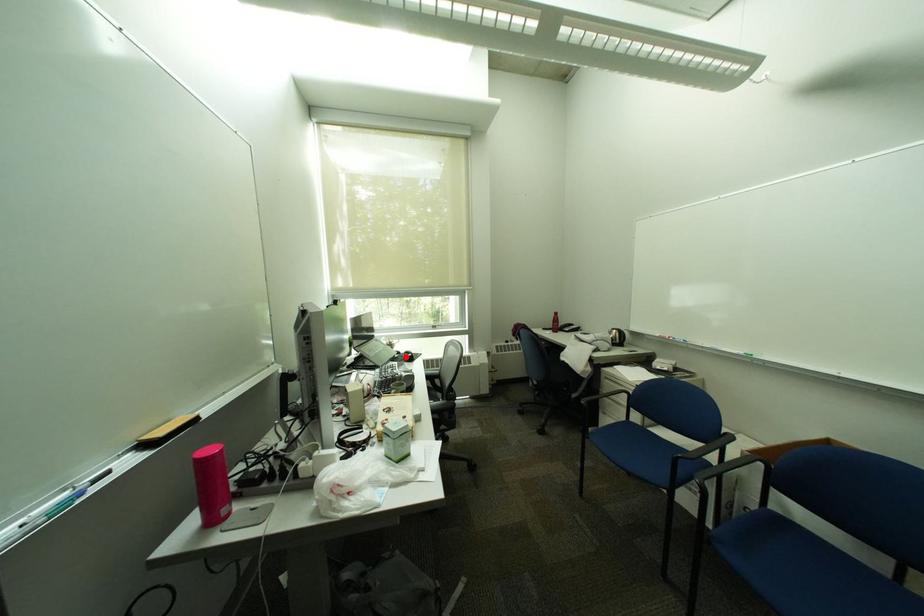
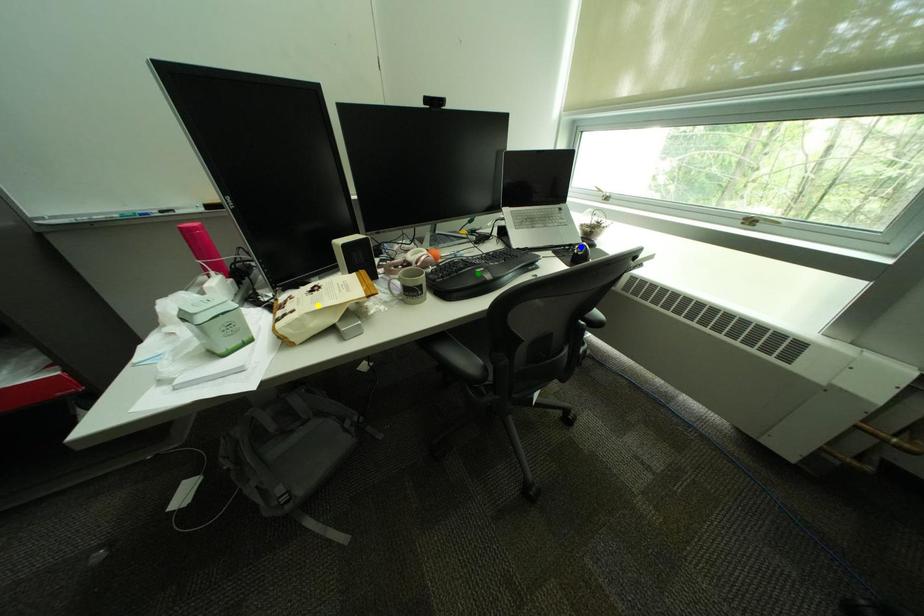
Question: I am providing you with two images of the same scene from different viewpoints. A red point is marked on the first image. You are given multiple points on the second image. Which point in image 2 is actually the same real-world point as the red point in image 1?

Choices:
 (A) green point
 (B) yellow point
 (C) blue point

Answer: (C)